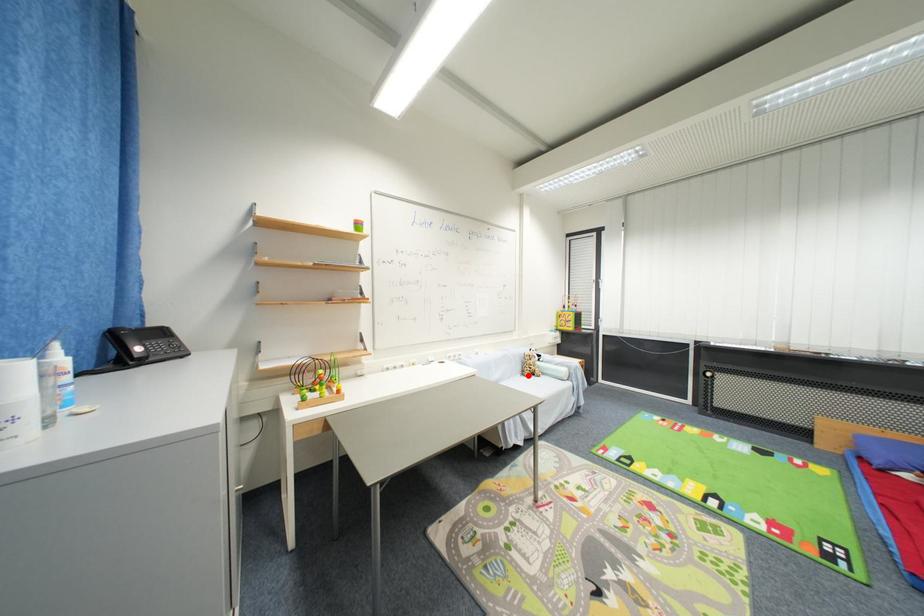
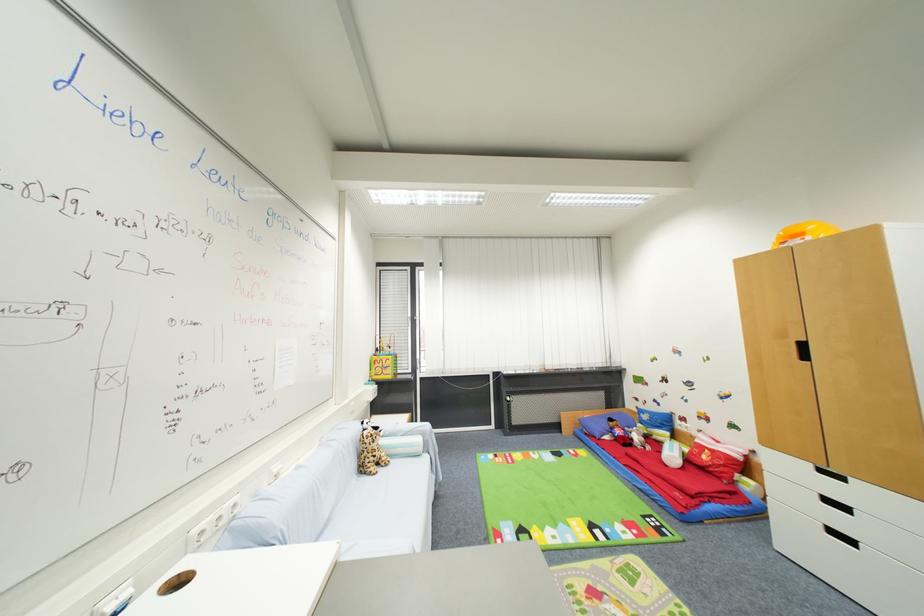
Find the pixel in the second image that matches the highlighted location in the first image.

(367, 472)